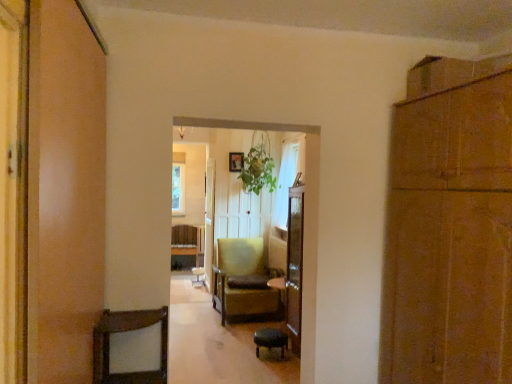
What is the approximate width of brown cardboard cabinet at right?

brown cardboard cabinet at right is 24.92 inches in width.

Where is `green leafy plant at center`? The width and height of the screenshot is (512, 384). green leafy plant at center is located at coordinates (258, 167).

From the image's perspective, which object appears higher, brown leather bar stool at lower center or brown cardboard cabinet at right?

brown cardboard cabinet at right appears higher in the image.

What's the angular difference between brown leather bar stool at lower center and brown cardboard cabinet at right's facing directions?

The angle between the facing direction of brown leather bar stool at lower center and the facing direction of brown cardboard cabinet at right is 2.45 degrees.

Is brown leather bar stool at lower center inside or outside of brown cardboard cabinet at right?

The correct answer is: outside.

Considering the sizes of objects brown leather bar stool at lower center and brown cardboard cabinet at right in the image provided, who is thinner, brown leather bar stool at lower center or brown cardboard cabinet at right?

With smaller width is brown leather bar stool at lower center.

Considering the relative sizes of brown cardboard cabinet at right and green leafy plant at center in the image provided, is brown cardboard cabinet at right wider than green leafy plant at center?

No, brown cardboard cabinet at right is not wider than green leafy plant at center.

Which of these two, brown cardboard cabinet at right or green leafy plant at center, stands shorter?

Standing shorter between the two is green leafy plant at center.

Is brown cardboard cabinet at right to the left of green leafy plant at center from the viewer's perspective?

No, brown cardboard cabinet at right is not to the left of green leafy plant at center.

In the image, is brown cardboard cabinet at right positioned in front of or behind green leafy plant at center?

brown cardboard cabinet at right is positioned closer to the viewer than green leafy plant at center.

From a real-world perspective, which is physically below, yellow fabric chair at center or brown cardboard cabinet at right?

In real-world perspective, yellow fabric chair at center is lower.

Consider the image. Would you consider yellow fabric chair at center to be distant from brown cardboard cabinet at right?

That's right, there is a large distance between yellow fabric chair at center and brown cardboard cabinet at right.

Is yellow fabric chair at center to the left or to the right of brown cardboard cabinet at right in the image?

yellow fabric chair at center is positioned on brown cardboard cabinet at right's left side.

Is brown cardboard cabinet at right at the left side of yellow fabric chair at center?

No.

Which of these two, brown cardboard cabinet at right or yellow fabric chair at center, is wider?

yellow fabric chair at center is wider.

Is brown cardboard cabinet at right oriented towards yellow fabric chair at center?

No, brown cardboard cabinet at right is not turned towards yellow fabric chair at center.

How far apart are brown cardboard cabinet at right and yellow fabric chair at center?

3.11 meters.

Which object is thinner, brown cardboard cabinet at right or brown leather bar stool at lower center?

brown leather bar stool at lower center.

How many degrees apart are the facing directions of brown cardboard cabinet at right and brown leather bar stool at lower center?

They differ by 2.45 degrees in their facing directions.

From the image's perspective, is brown cardboard cabinet at right over brown leather bar stool at lower center?

Yes, from the image's perspective, brown cardboard cabinet at right is on top of brown leather bar stool at lower center.

Do you think brown cardboard cabinet at right is within brown leather bar stool at lower center, or outside of it?

brown cardboard cabinet at right is not enclosed by brown leather bar stool at lower center.

Is yellow fabric chair at center thinner than brown leather bar stool at lower center?

No.

Considering the sizes of objects yellow fabric chair at center and brown leather bar stool at lower center in the image provided, who is bigger, yellow fabric chair at center or brown leather bar stool at lower center?

yellow fabric chair at center is bigger.

Locate an element on the screen. The height and width of the screenshot is (384, 512). chair behind the brown leather bar stool at lower center is located at coordinates (244, 281).

I want to click on plant above the brown leather bar stool at lower center (from a real-world perspective), so click(x=258, y=167).

Is point (247, 190) closer or farther from the camera than point (268, 340)?

Point (247, 190).

Does green leafy plant at center lie behind brown leather bar stool at lower center?

Yes, green leafy plant at center is further from the camera.

Does green leafy plant at center turn towards brown leather bar stool at lower center?

No, green leafy plant at center is not aimed at brown leather bar stool at lower center.

At what (x,y) coordinates should I click in order to perform the action: click on bar stool that appears below the brown cardboard cabinet at right (from the image's perspective). Please return your answer as a coordinate pair (x, y). The height and width of the screenshot is (384, 512). Looking at the image, I should click on (271, 340).

Find the location of a particular element. This screenshot has height=384, width=512. plant located above the brown cardboard cabinet at right (from the image's perspective) is located at coordinates (258, 167).

When comparing their distances from brown leather bar stool at lower center, does green leafy plant at center or brown cardboard cabinet at right seem further?

Based on the image, brown cardboard cabinet at right appears to be further to brown leather bar stool at lower center.

From the image, which object appears to be farther from green leafy plant at center, yellow fabric chair at center or brown cardboard cabinet at right?

brown cardboard cabinet at right.

Which object lies further to the anchor point green leafy plant at center, brown cardboard cabinet at right or yellow fabric chair at center?

Based on the image, brown cardboard cabinet at right appears to be further to green leafy plant at center.

In the scene shown: When comparing their distances from brown cardboard cabinet at right, does brown leather bar stool at lower center or yellow fabric chair at center seem further?

Based on the image, yellow fabric chair at center appears to be further to brown cardboard cabinet at right.

Estimate the real-world distances between objects in this image. Which object is further from brown leather bar stool at lower center, yellow fabric chair at center or green leafy plant at center?

Based on the image, green leafy plant at center appears to be further to brown leather bar stool at lower center.

Looking at the image, which one is located closer to yellow fabric chair at center, brown cardboard cabinet at right or green leafy plant at center?

green leafy plant at center.

Which object lies further to the anchor point yellow fabric chair at center, green leafy plant at center or brown leather bar stool at lower center?

Based on the image, green leafy plant at center appears to be further to yellow fabric chair at center.

Estimate the real-world distances between objects in this image. Which object is closer to brown leather bar stool at lower center, green leafy plant at center or yellow fabric chair at center?

Based on the image, yellow fabric chair at center appears to be nearer to brown leather bar stool at lower center.

Find the location of `chair between green leafy plant at center and brown leather bar stool at lower center from top to bottom`. chair between green leafy plant at center and brown leather bar stool at lower center from top to bottom is located at coordinates (244, 281).

Where is `bar stool between brown cardboard cabinet at right and yellow fabric chair at center from front to back`? bar stool between brown cardboard cabinet at right and yellow fabric chair at center from front to back is located at coordinates (271, 340).

Locate an element on the screen. chair between brown cardboard cabinet at right and green leafy plant at center in the front-back direction is located at coordinates click(x=244, y=281).

Find the location of a particular element. bar stool located between brown cardboard cabinet at right and green leafy plant at center in the depth direction is located at coordinates (271, 340).